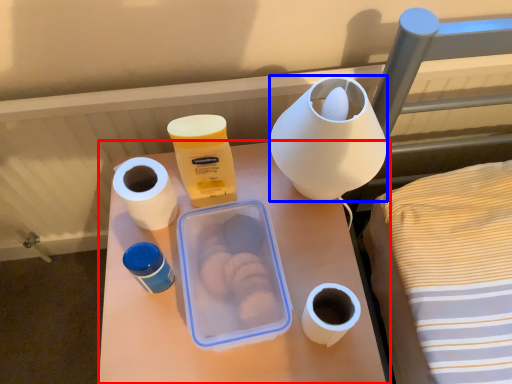
Question: Which point is closer to the camera, table (highlighted by a red box) or pottery (highlighted by a blue box)?

Choices:
 (A) table
 (B) pottery

Answer: (B)